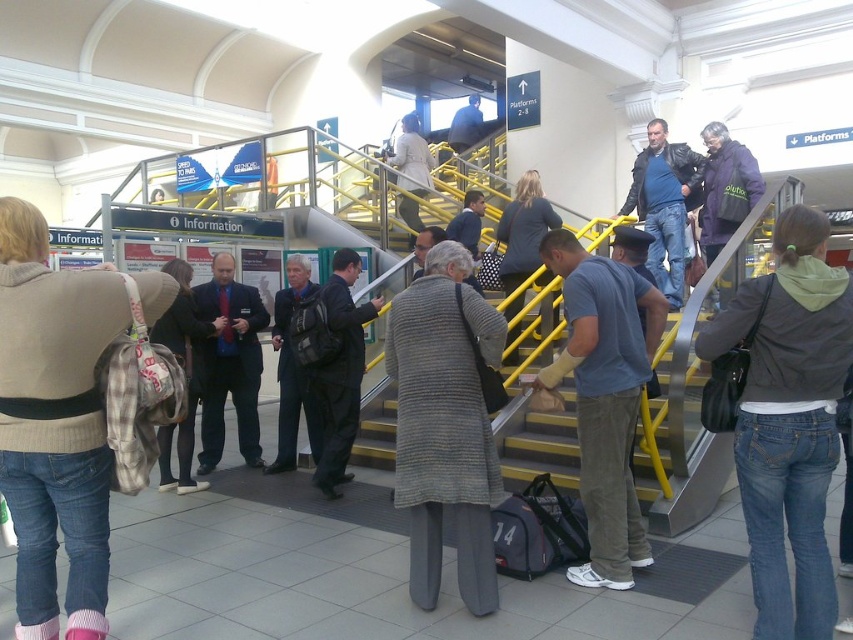
Looking at this image, can you confirm if denim jeans at left is positioned below light beige coat at upper center?

Yes.

Does denim jeans at left appear on the left side of light beige coat at upper center?

Indeed, denim jeans at left is positioned on the left side of light beige coat at upper center.

Between point (108, 323) and point (404, 144), which one is positioned in front?

Point (108, 323) is in front.

The image size is (853, 640). What are the coordinates of `denim jeans at left` in the screenshot? It's located at (54, 422).

Does blue cotton t-shirt at center have a greater height compared to dark gray jacket at center?

Indeed, blue cotton t-shirt at center has a greater height compared to dark gray jacket at center.

Who is positioned more to the left, blue cotton t-shirt at center or dark gray jacket at center?

dark gray jacket at center is more to the left.

From the picture: Who is more forward, (596, 388) or (331, 476)?

Point (596, 388) is more forward.

This screenshot has height=640, width=853. In order to click on blue cotton t-shirt at center in this screenshot , I will do `click(604, 397)`.

Which is more to the left, denim jeans at left or dark blue jacket at center?

From the viewer's perspective, dark blue jacket at center appears more on the left side.

Is denim jeans at left bigger than dark blue jacket at center?

Yes.

This screenshot has height=640, width=853. What do you see at coordinates (54, 422) in the screenshot?
I see `denim jeans at left` at bounding box center [54, 422].

Where is `denim jeans at left`? denim jeans at left is located at coordinates (54, 422).